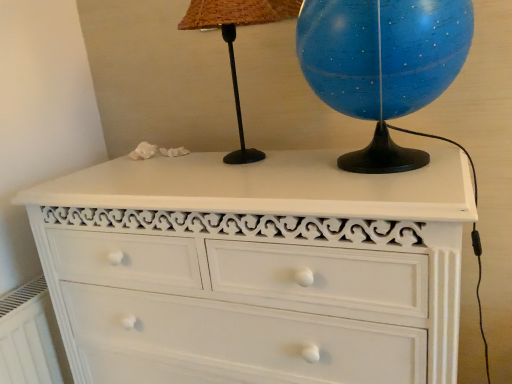
Locate an element on the screen. The width and height of the screenshot is (512, 384). free space on the front side of black matte table lamp at upper center is located at coordinates (232, 180).